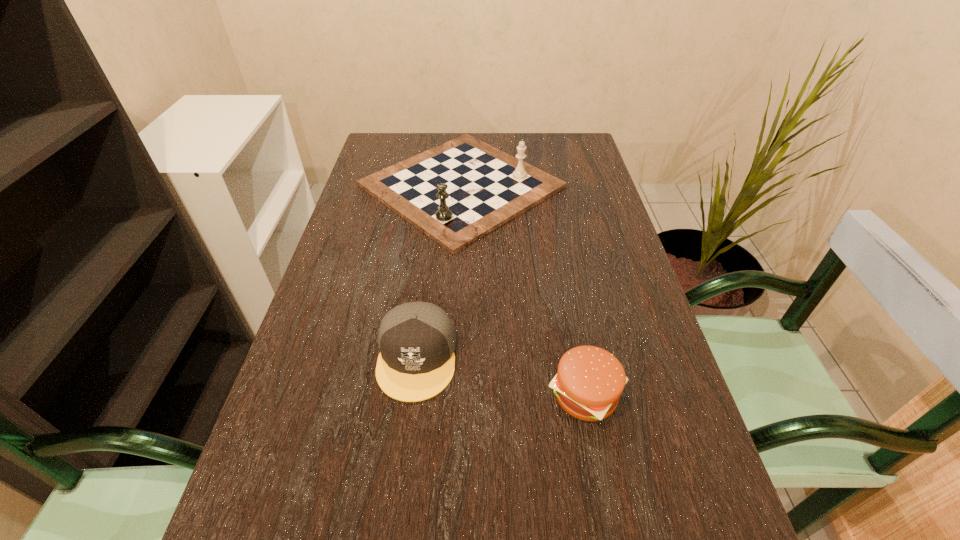
Identify the location of hamburger situated at the right edge. This screenshot has width=960, height=540. (x=589, y=382).

This screenshot has height=540, width=960. In order to click on object situated at the far left corner in this screenshot , I will do `click(457, 192)`.

Find the location of a particular element. This screenshot has width=960, height=540. object positioned at the far right corner is located at coordinates (457, 192).

Find the location of a particular element. This screenshot has width=960, height=540. vacant area at the far edge is located at coordinates (506, 151).

Locate an element on the screen. The height and width of the screenshot is (540, 960). vacant space at the left edge of the desktop is located at coordinates (367, 234).

Where is `free space at the right edge`? This screenshot has width=960, height=540. free space at the right edge is located at coordinates (649, 315).

In the image, there is a desktop. At what (x,y) coordinates should I click in order to perform the action: click on free space at the far right corner. Please return your answer as a coordinate pair (x, y). The height and width of the screenshot is (540, 960). Looking at the image, I should click on (540, 136).

Identify the location of free space between the hamburger and the farthest object. (523, 290).

Find the location of `empty location between the farthest object and the hamburger`. empty location between the farthest object and the hamburger is located at coordinates (523, 290).

Locate an element on the screen. This screenshot has height=540, width=960. free space between the gameboard and the cap is located at coordinates (439, 272).